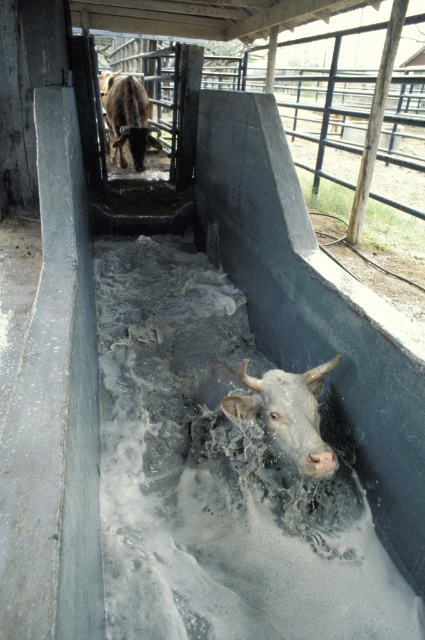
You are a farmer checking the cattle washing area. You see the gray matte cow at center and the brown glossy bull at upper center. Which animal is closer to you?

The gray matte cow at center is closer to you because it is positioned in front of the brown glossy bull at upper center.

From the picture: You are a farmer observing the cattle washing area. You notice the gray matte cow at center and the brown glossy bull at upper center. Which animal is positioned closer to the right side of the trough?

The gray matte cow at center is positioned to the right of the brown glossy bull at upper center, so it is closer to the right side of the trough.

Consider the image. You are a farmer checking the cattle washing area. You see the gray matte cow at center and the brown glossy bull at upper center. Which animal is positioned higher in the scene?

The brown glossy bull at upper center is positioned higher than the gray matte cow at center.